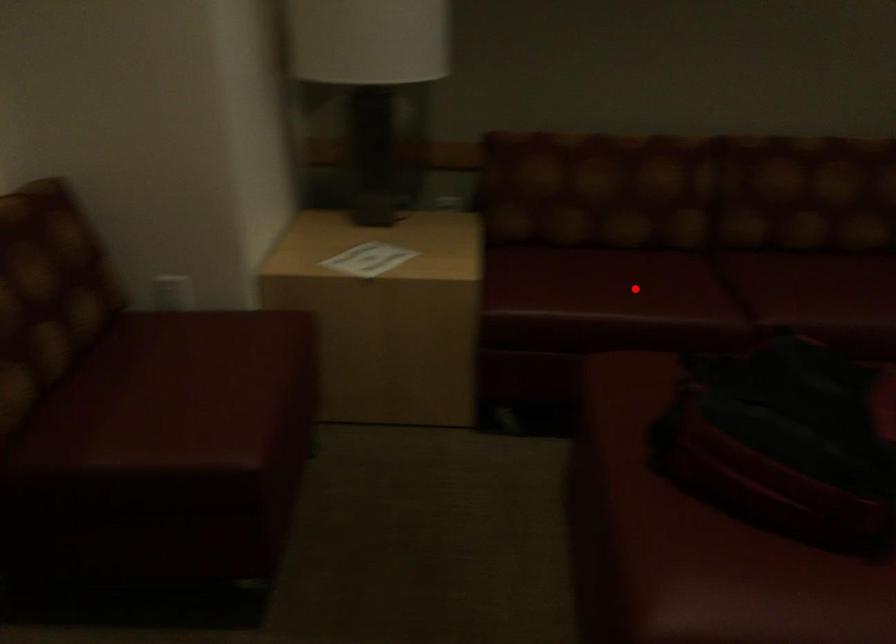
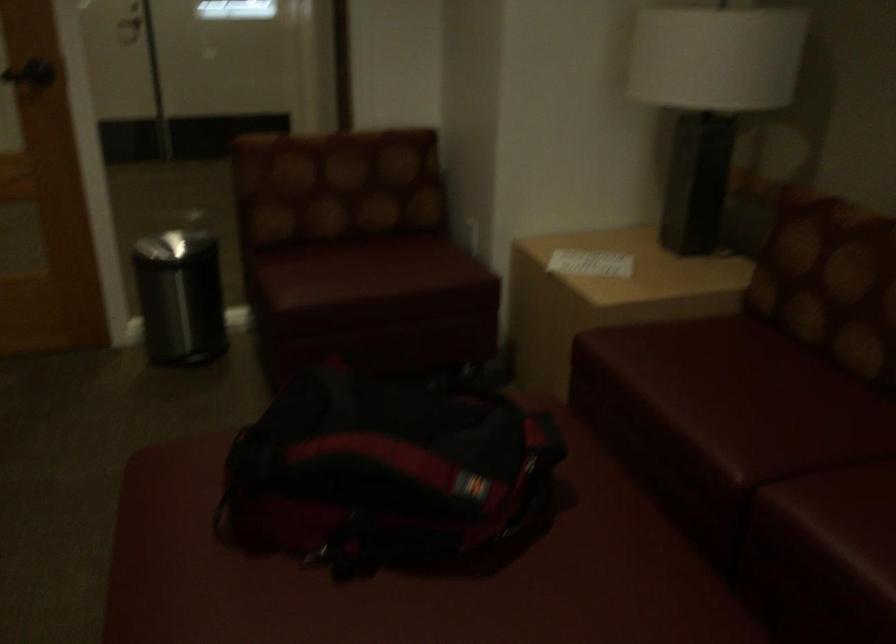
Question: I am providing you with two images of the same scene from different viewpoints. Image1 has a red point marked. In image2, the corresponding 3D location appears at what relative position? Reply with the corresponding letter.

Choices:
 (A) Closer
 (B) Farther

Answer: (A)